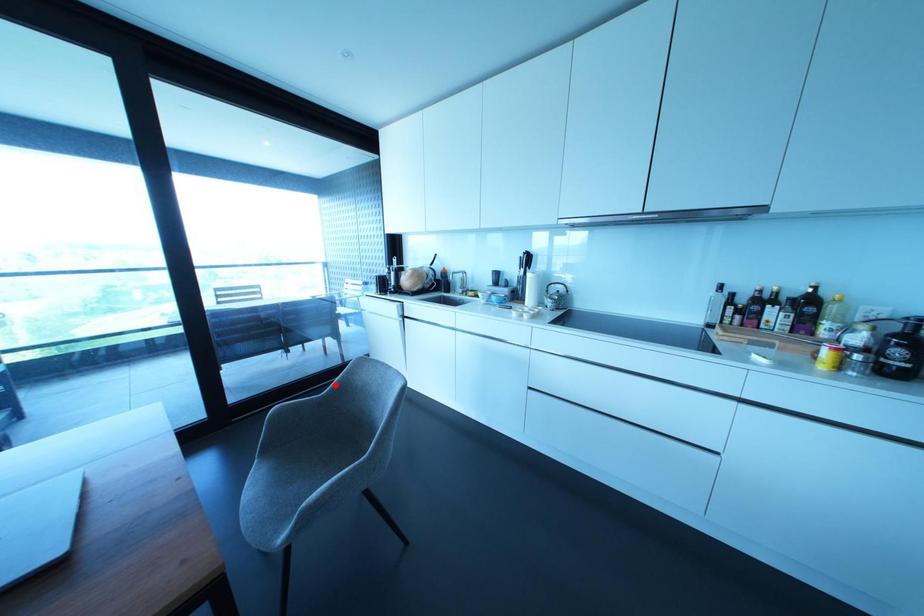
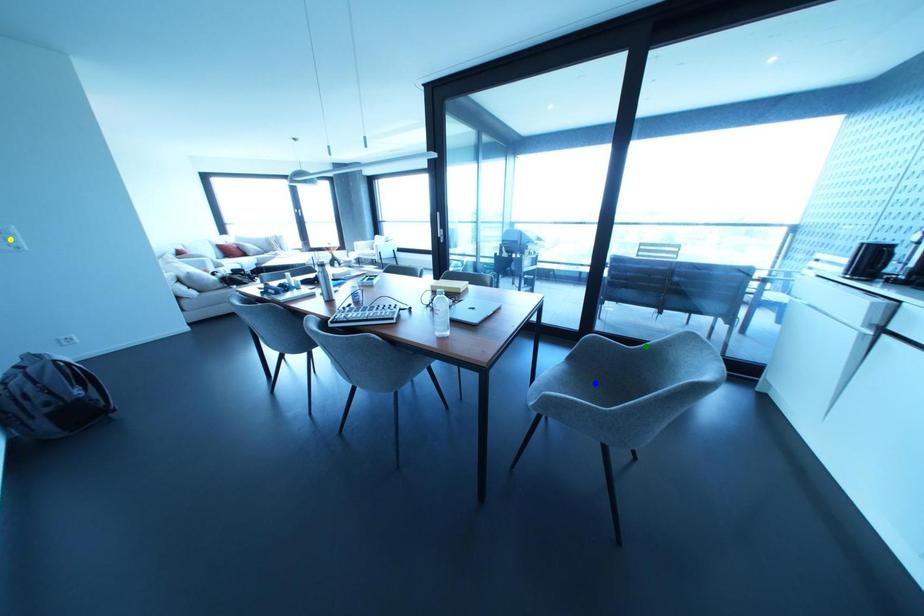
Question: I am providing you with two images of the same scene from different viewpoints. A red point is marked on the first image. You are given multiple points on the second image. Can you choose the point in image 2 that corresponds to the point in image 1?

Choices:
 (A) blue point
 (B) yellow point
 (C) green point

Answer: (C)